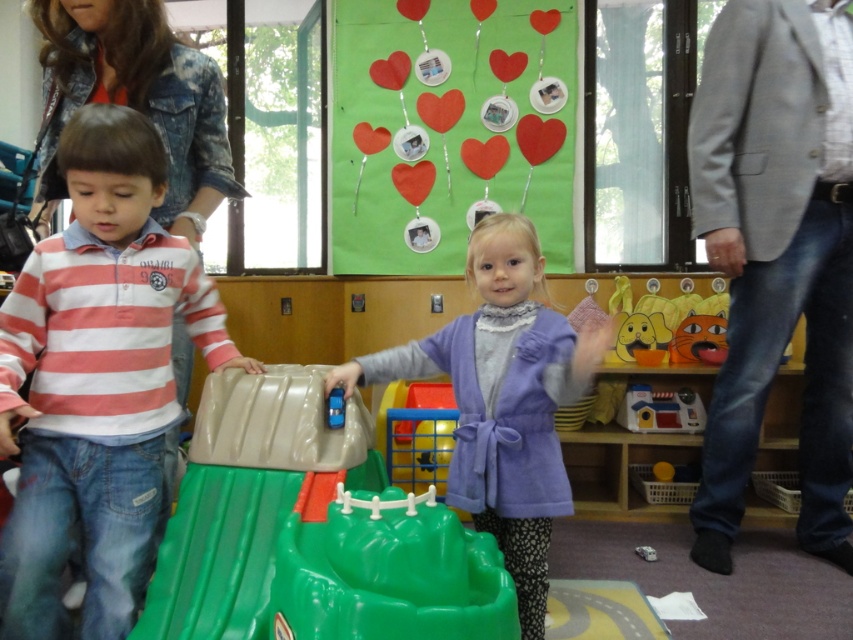
Question: Does striped cotton shirt at left have a greater width compared to green plastic toy at center?

Choices:
 (A) no
 (B) yes

Answer: (A)

Question: Among these objects, which one is nearest to the camera?

Choices:
 (A) blue plastic car at center
 (B) green paper heart at upper center
 (C) matte plastic toy at right

Answer: (A)

Question: Does green paper heart at upper center have a lesser width compared to purple soft toy at center?

Choices:
 (A) yes
 (B) no

Answer: (B)

Question: Which point appears closest to the camera in this image?

Choices:
 (A) (569, 387)
 (B) (286, 488)

Answer: (B)

Question: Which object is the closest to the matte plastic toy at right?

Choices:
 (A) green plastic toy at center
 (B) blue plastic car at center
 (C) green paper heart at upper center

Answer: (C)

Question: Where is green plastic toy at center located in relation to matte plastic toy at right in the image?

Choices:
 (A) left
 (B) right

Answer: (A)